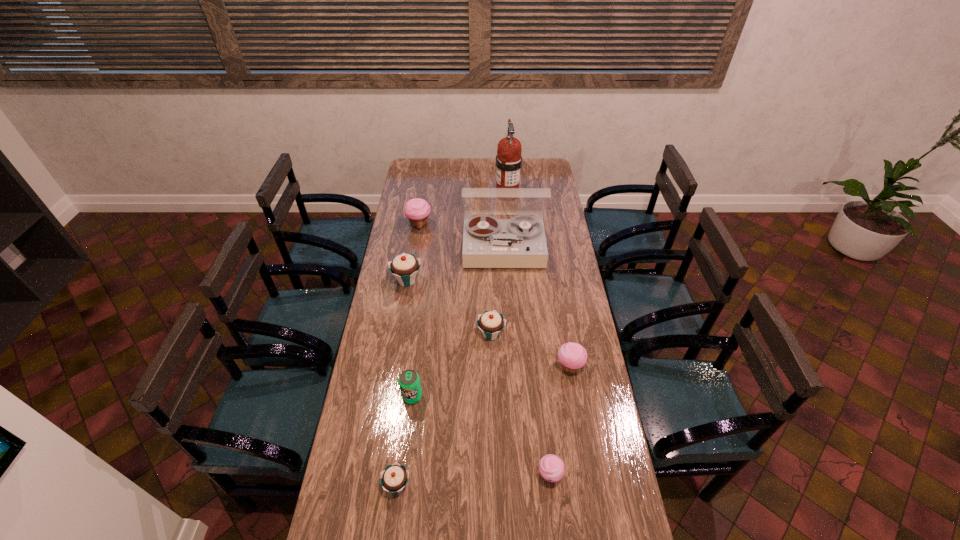
Image resolution: width=960 pixels, height=540 pixels. What are the coordinates of `the rightmost pink cupcake` in the screenshot? It's located at (572, 356).

Find the location of `the second smallest teal cupcake`. the second smallest teal cupcake is located at coordinates (491, 323).

This screenshot has height=540, width=960. I want to click on the fifth farthest object, so click(491, 323).

Where is `the smallest teal cupcake`? the smallest teal cupcake is located at coordinates (394, 478).

This screenshot has width=960, height=540. In order to click on the second pink cupcake from right to left in this screenshot , I will do `click(551, 468)`.

Where is `the smallest pink cupcake`? the smallest pink cupcake is located at coordinates (551, 468).

The height and width of the screenshot is (540, 960). I want to click on free region located 0.050m at the nozzle of the farthest object, so (509, 214).

This screenshot has width=960, height=540. What are the coordinates of `vacant space situated 0.150m on the front of the white record player` in the screenshot? It's located at (506, 293).

Identify the location of free location located 0.340m on the right of the biggest pink cupcake. This screenshot has height=540, width=960. (497, 225).

The width and height of the screenshot is (960, 540). What are the coordinates of `free region located 0.260m on the right of the biggest teal cupcake` in the screenshot? It's located at click(481, 280).